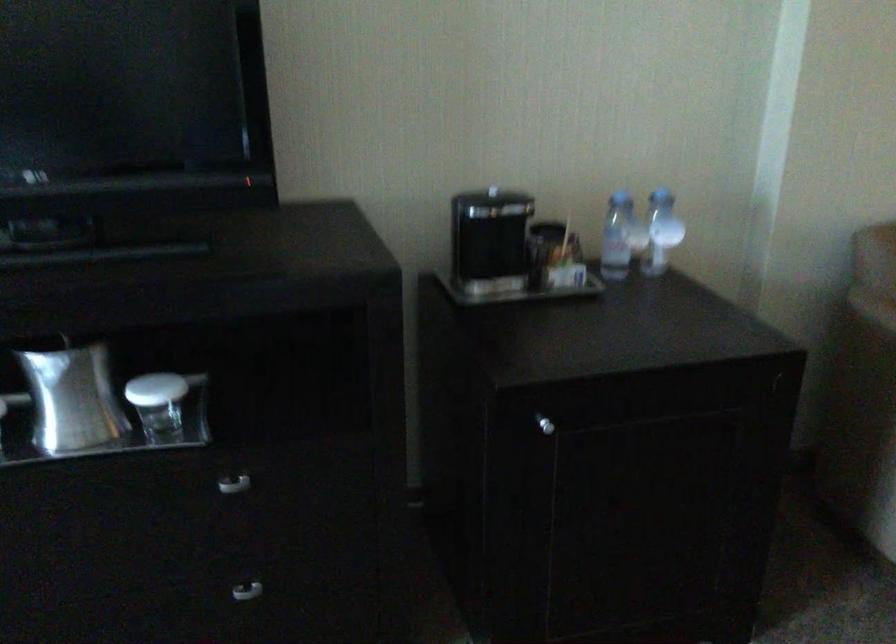
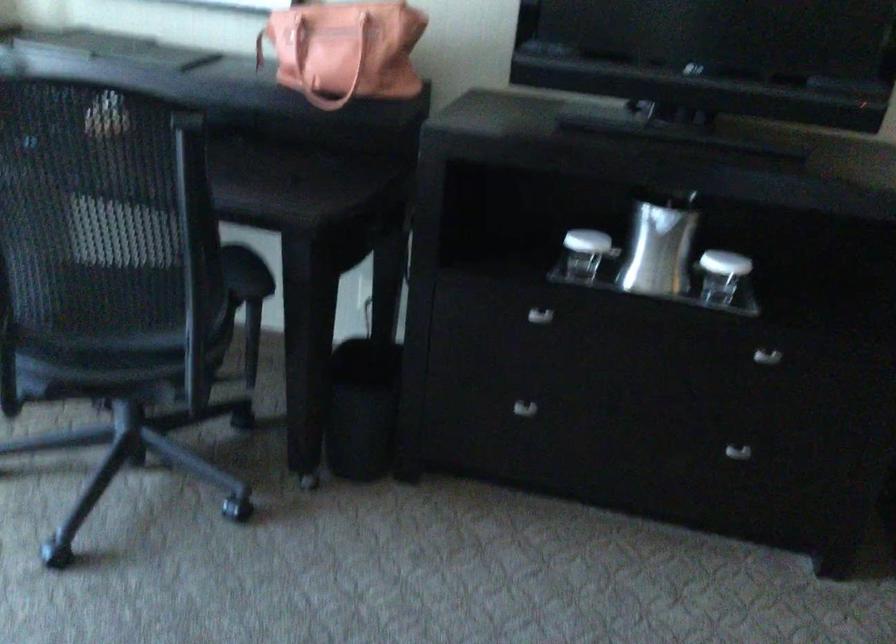
Find the pixel in the second image that matches pixel 159 406 in the first image.

(721, 275)